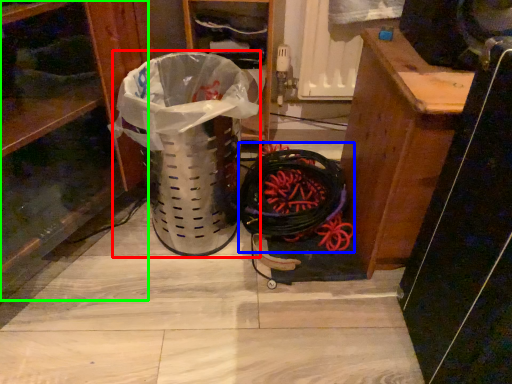
Question: Based on their relative distances, which object is farther from garbage (highlighted by a red box)? Choose from battle rope (highlighted by a blue box) and shelf (highlighted by a green box).

Choices:
 (A) battle rope
 (B) shelf

Answer: (A)